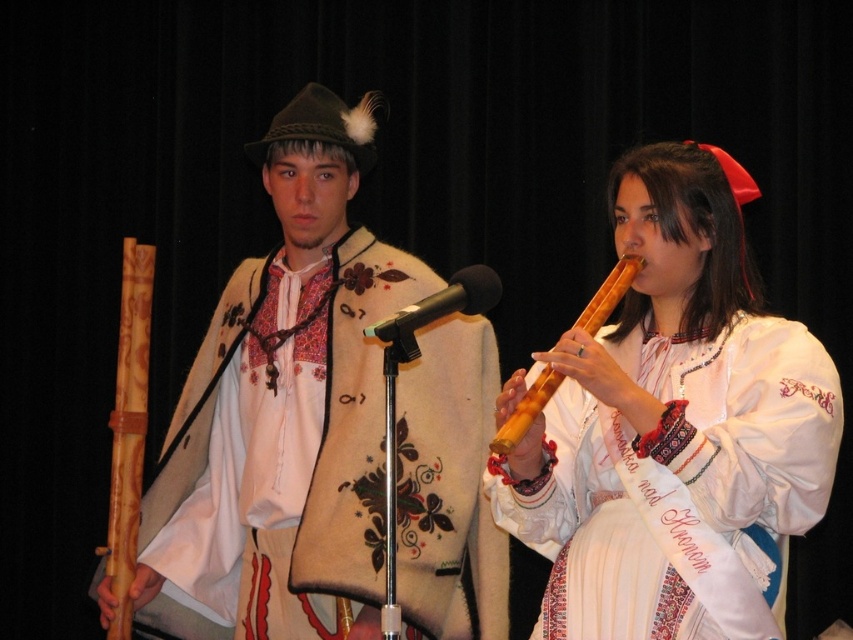
You are designing a cultural exhibition layout and need to place a mannequin wearing the white embroidered blouse at right and another wearing the white woolen vest at center. Based on their sizes, which mannequin should be placed in a smaller display area?

The white embroidered blouse at right occupies less space than the white woolen vest at center, so the mannequin wearing the white embroidered blouse at right should be placed in the smaller display area.

You are a stagehand preparing for a performance. You need to place both the black matte microphone at center and the wooden flute at center on a small shelf that can only hold items occupying the same amount of space. Based on the scene description, can both items fit on the shelf together?

The black matte microphone at center occupies less space than the wooden flute at center. Since the shelf can only hold items of the same space, the microphone takes up less space, but combined their total space would exceed the shelf capacity. Therefore, both items cannot fit together.